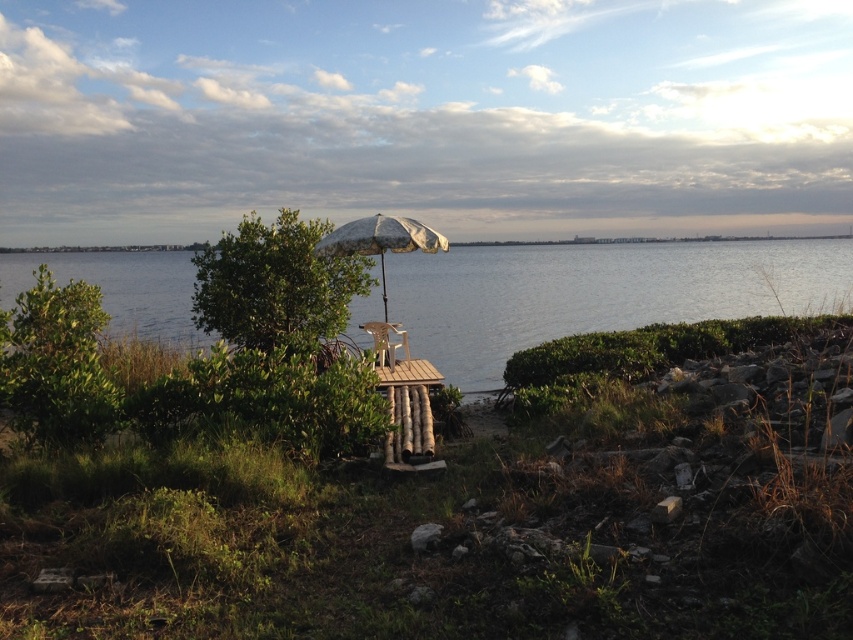
You are planning to set up a picnic area in the lakeside scene. The green leafy tree at center and the metallic silver beach chair at center are both in your view. Which object would provide more shade for your picnic setup?

The green leafy tree at center is larger in size than the metallic silver beach chair at center, so it would provide more shade for the picnic setup.

You are standing at the lakeside and want to reach the point marked at coordinates [322,292]. If your walking speed is 1.5 meters per second, how many seconds will it take you to reach that point?

The point marked at coordinates [322,292] is 12.83 meters away from you. At a walking speed of 1.5 meters per second, it will take approximately 8.55 seconds to reach it. Since the question asks for the time in seconds, rounding to the nearest whole number gives about 9 seconds.

You are planning to set up a small picnic table between the green leafy tree at center and the metallic silver beach chair at center. The picnic table requires a space of 2 meters. Do you think there is enough space between them?

The green leafy tree at center is 1.87 meters from the metallic silver beach chair at center. Since the required space for the picnic table is 2 meters, there is not enough space between them.